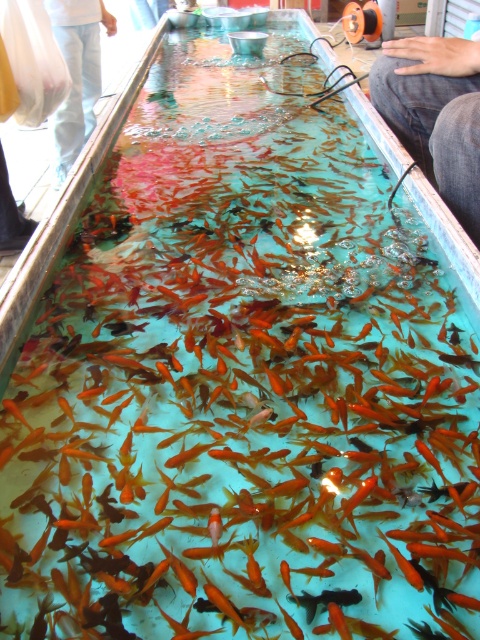
Question: Which object is farther from the camera taking this photo?

Choices:
 (A) jeans at center
 (B) white cotton pants at upper left

Answer: (B)

Question: From the image, what is the correct spatial relationship of jeans at center in relation to white cotton pants at upper left?

Choices:
 (A) below
 (B) above

Answer: (A)

Question: Does jeans at center appear on the left side of white cotton pants at upper left?

Choices:
 (A) yes
 (B) no

Answer: (B)

Question: Among these points, which one is nearest to the camera?

Choices:
 (A) (476, 83)
 (B) (72, 157)

Answer: (A)

Question: From the image, what is the correct spatial relationship of jeans at center in relation to white cotton pants at upper left?

Choices:
 (A) left
 (B) right

Answer: (B)